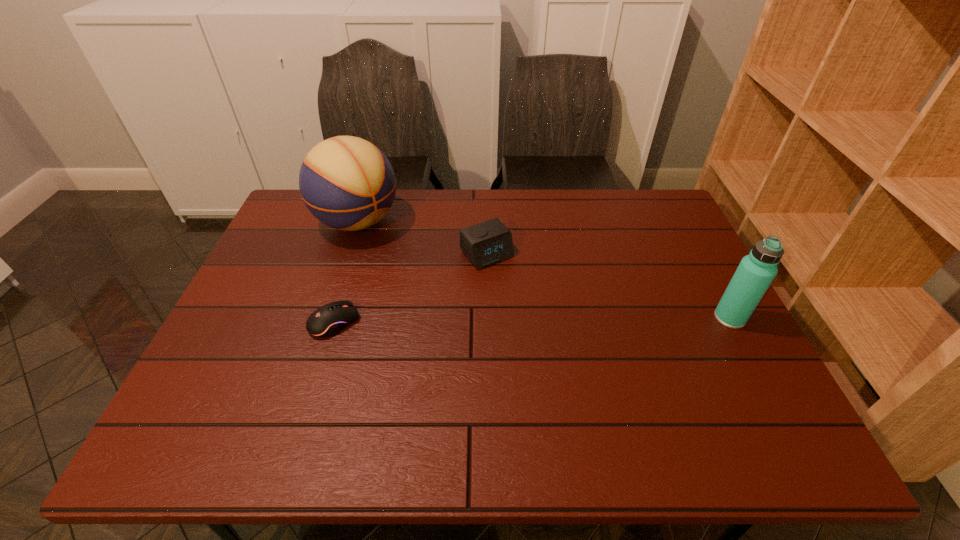
In order to click on computer mouse in this screenshot , I will do `click(328, 320)`.

Locate an element on the screen. Image resolution: width=960 pixels, height=540 pixels. thermos bottle is located at coordinates (756, 271).

The width and height of the screenshot is (960, 540). In order to click on alarm clock in this screenshot , I will do `click(486, 243)`.

In order to click on the second object from right to left in this screenshot , I will do `click(486, 243)`.

Find the location of a particular element. The width and height of the screenshot is (960, 540). basketball is located at coordinates (346, 182).

At what (x,y) coordinates should I click in order to perform the action: click on free spot located on the right of the computer mouse. Please return your answer as a coordinate pair (x, y). Looking at the image, I should click on (435, 322).

Where is `vacant space positioned on the front of the rightmost object`? The height and width of the screenshot is (540, 960). vacant space positioned on the front of the rightmost object is located at coordinates (752, 360).

I want to click on vacant space located on the front-facing side of the alarm clock, so click(x=565, y=342).

Find the location of `vacant space situated on the front-facing side of the alarm clock`. vacant space situated on the front-facing side of the alarm clock is located at coordinates (558, 334).

Find the location of `vacant space located on the front-facing side of the alarm clock`. vacant space located on the front-facing side of the alarm clock is located at coordinates (556, 331).